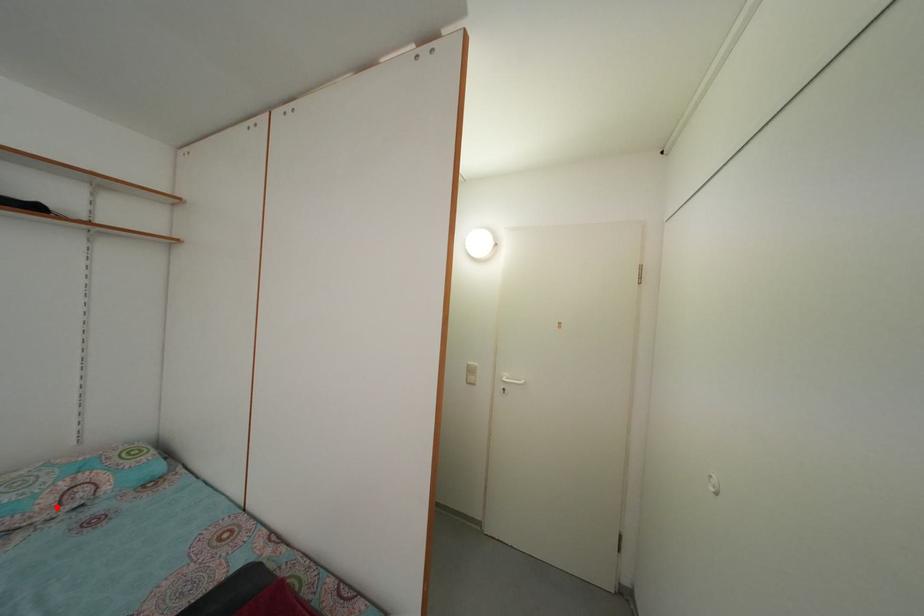
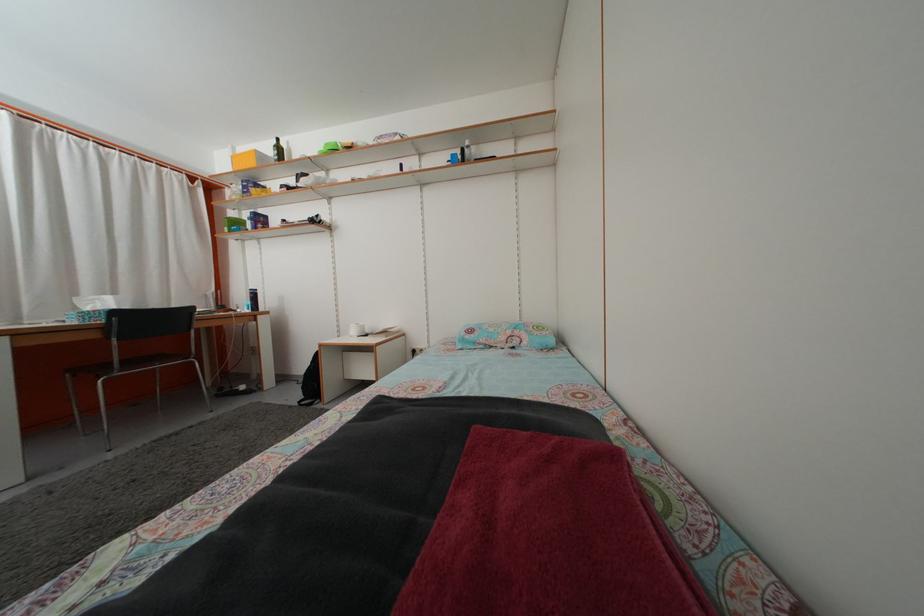
Question: I am providing you with two images of the same scene from different viewpoints. A red point is shown in image1. For the corresponding object point in image2, is it positioned nearer or farther from the camera?

Choices:
 (A) Nearer
 (B) Farther

Answer: (B)